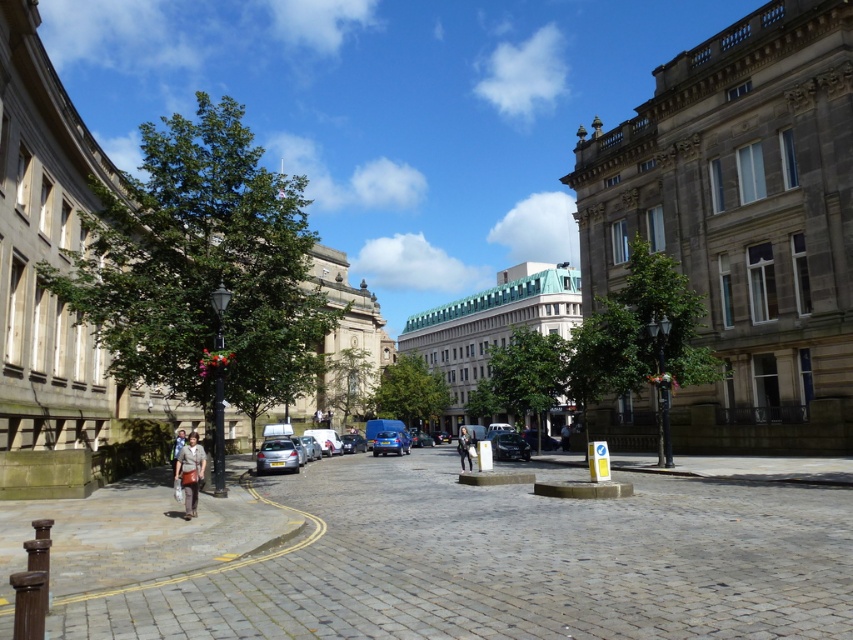
You are standing at the center of the street in this historical area. You notice a matte brown coat at lower left. Where exactly is the matte brown coat located in relation to your current position?

The matte brown coat at lower left is located at coordinates point (190, 472) relative to your position at the center of the street.

You are standing at the center of the street in the image. There is a point marked at coordinate (x=277, y=456). Which object is this point located on?

The point at coordinate (x=277, y=456) is located on the metallic silver car at lower left.

You are a pedestrian standing on the sidewalk in this urban scene. You want to cross the street to reach a coffee shop on the other side. The metallic silver car at lower left is blocking your path. Can you walk around it to reach the dark blue jeans at center, which marks the spot where you need to cross? Explain why.

The metallic silver car at lower left is located above the dark blue jeans at center. Since the car is above the jeans in the image, it means the car is positioned higher up, possibly on a raised area or closer to the viewer. Therefore, you can walk around the car to reach the dark blue jeans at center as the car does not directly block the path to the crossing point marked by the jeans.